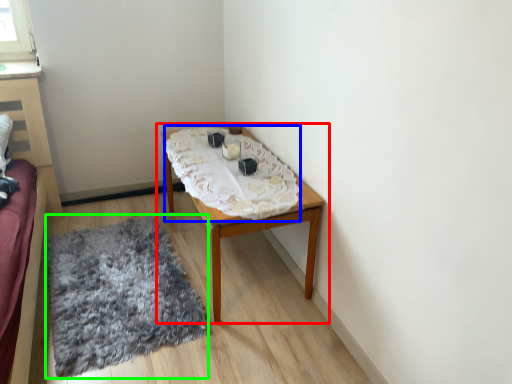
Question: Which object is the closest to the table (highlighted by a red box)? Choose among these: blanket (highlighted by a blue box) or mat (highlighted by a green box).

Choices:
 (A) blanket
 (B) mat

Answer: (A)